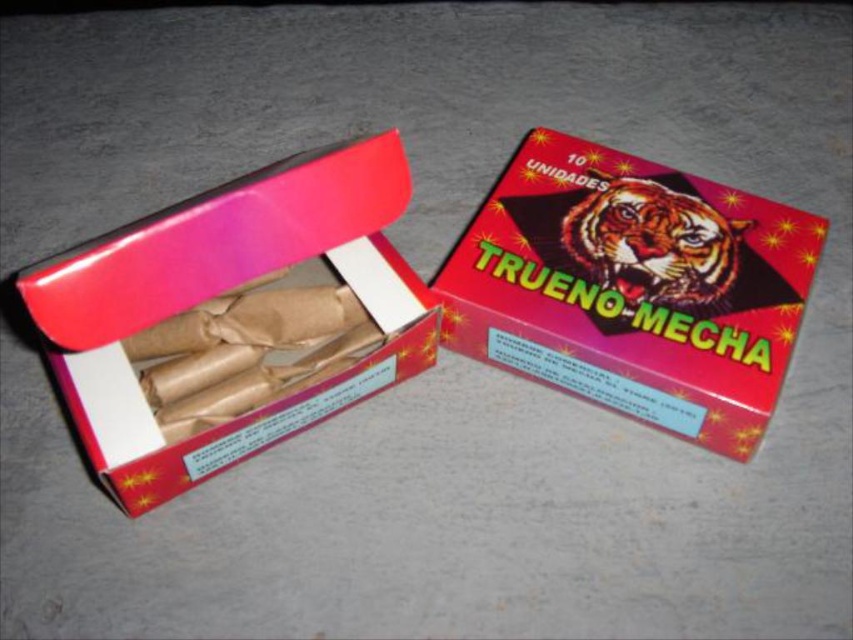
Which is more to the left, shiny red cardboard box at center or shiny orange tiger at center?

shiny red cardboard box at center is more to the left.

Who is more forward, (695, 188) or (712, 276)?

Point (712, 276) is more forward.

What do you see at coordinates (633, 289) in the screenshot?
I see `shiny red cardboard box at center` at bounding box center [633, 289].

You are a GUI agent. You are given a task and a screenshot of the screen. Output one action in this format:
    pyautogui.click(x=<x>, y=<y>)
    Task: Click on the shiny red cardboard box at center
    This screenshot has width=853, height=640.
    Given the screenshot: What is the action you would take?
    pyautogui.click(x=633, y=289)

Where is `shiny red cardboard box at center`? Image resolution: width=853 pixels, height=640 pixels. shiny red cardboard box at center is located at coordinates (633, 289).

Between shiny red cardboard box at center and matte cardboard box at left, which one has more height?

matte cardboard box at left

Who is more forward, (650,236) or (67,346)?

Point (67,346) is more forward.

The image size is (853, 640). I want to click on shiny red cardboard box at center, so click(x=633, y=289).

Does matte cardboard box at left appear over shiny orange tiger at center?

Actually, matte cardboard box at left is below shiny orange tiger at center.

Does matte cardboard box at left have a larger size compared to shiny orange tiger at center?

Yes.

Is point (209, 468) closer to camera compared to point (616, 182)?

Yes, it is.

Locate an element on the screen. The height and width of the screenshot is (640, 853). matte cardboard box at left is located at coordinates (225, 289).